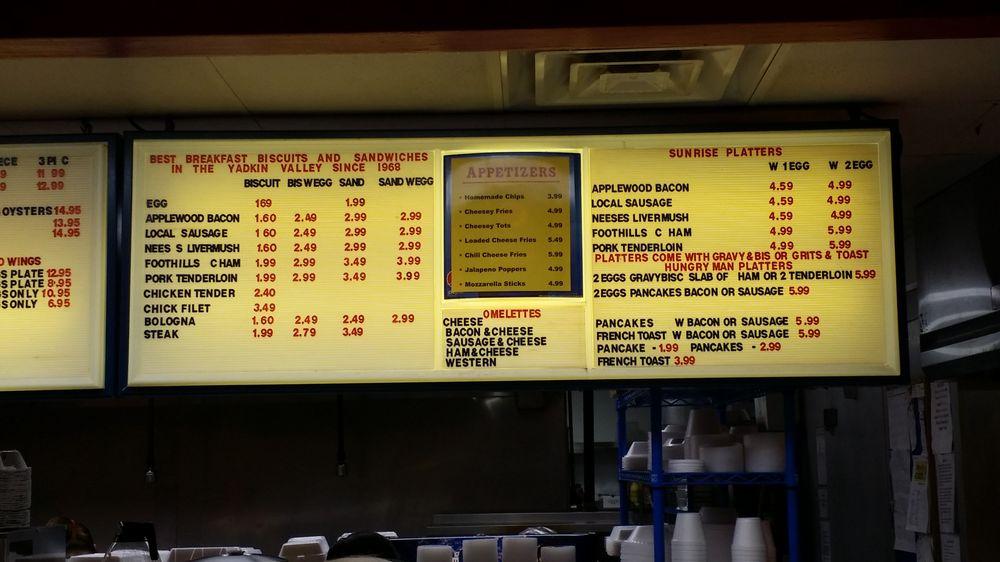
This screenshot has width=1000, height=562. Identify the location of platters. (632, 253), (764, 149), (762, 265).